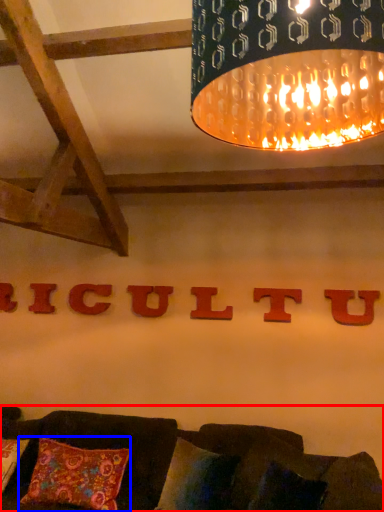
Question: Which object appears closest to the camera in this image, studio couch (highlighted by a red box) or pillow (highlighted by a blue box)?

Choices:
 (A) studio couch
 (B) pillow

Answer: (A)